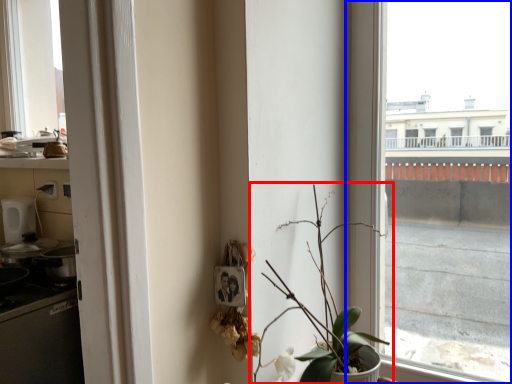
Question: Which of the following is the closest to the observer, houseplant (highlighted by a red box) or window (highlighted by a blue box)?

Choices:
 (A) houseplant
 (B) window

Answer: (A)